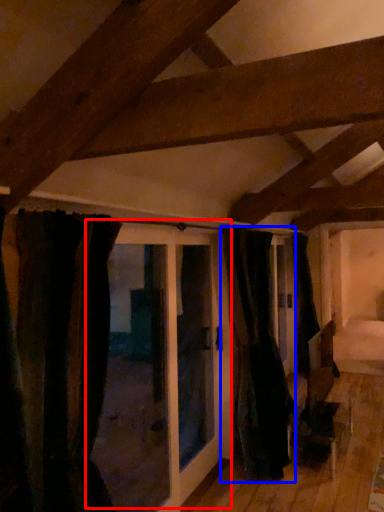
Question: Among these objects, which one is farthest to the camera, door (highlighted by a red box) or curtain (highlighted by a blue box)?

Choices:
 (A) door
 (B) curtain

Answer: (B)